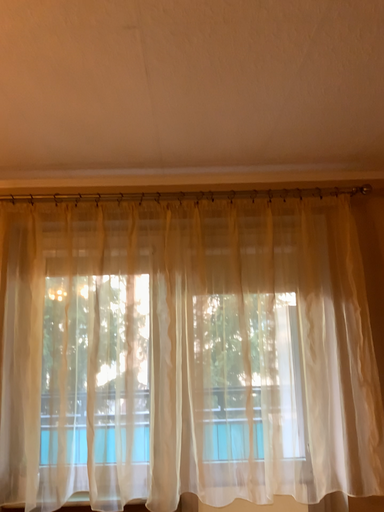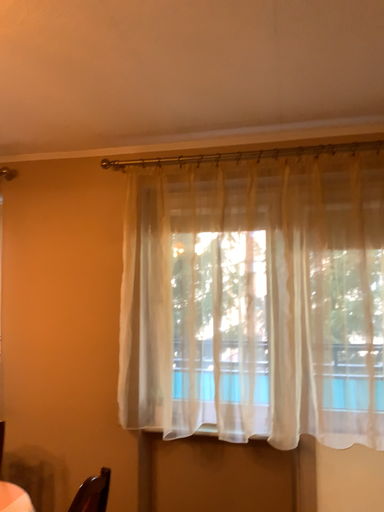
Question: How did the camera likely rotate when shooting the video?

Choices:
 (A) rotated right
 (B) rotated left

Answer: (B)